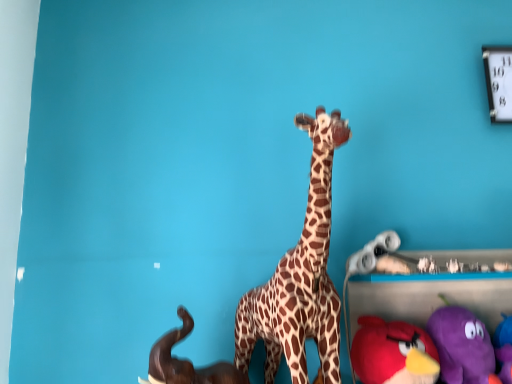
Question: Considering the relative positions of velvet plush bird at lower right, which appears as the second toy when viewed from the right, and purple plush toy at lower right, positioned as the 4th toy in left-to-right order, in the image provided, is velvet plush bird at lower right, which appears as the second toy when viewed from the right, to the left of purple plush toy at lower right, positioned as the 4th toy in left-to-right order, from the viewer's perspective?

Choices:
 (A) yes
 (B) no

Answer: (A)

Question: From the image's perspective, is velvet plush bird at lower right, which appears as the second toy when viewed from the right, beneath purple plush toy at lower right, the first toy positioned from the right?

Choices:
 (A) yes
 (B) no

Answer: (A)

Question: Considering the relative sizes of velvet plush bird at lower right, which appears as the second toy when viewed from the right, and purple plush toy at lower right, positioned as the 4th toy in left-to-right order, in the image provided, is velvet plush bird at lower right, which appears as the second toy when viewed from the right, thinner than purple plush toy at lower right, positioned as the 4th toy in left-to-right order,?

Choices:
 (A) yes
 (B) no

Answer: (A)

Question: Is velvet plush bird at lower right, positioned as the 3th toy in left-to-right order, touching purple plush toy at lower right, the first toy positioned from the right?

Choices:
 (A) yes
 (B) no

Answer: (A)

Question: Is velvet plush bird at lower right, positioned as the 3th toy in left-to-right order, shorter than purple plush toy at lower right, the first toy positioned from the right?

Choices:
 (A) yes
 (B) no

Answer: (A)

Question: In terms of height, does metallic silver clock at upper right look taller or shorter compared to brown matte elephant at lower left, marked as the 4th toy in a right-to-left arrangement?

Choices:
 (A) tall
 (B) short

Answer: (A)

Question: Is metallic silver clock at upper right bigger or smaller than brown matte elephant at lower left, marked as the 4th toy in a right-to-left arrangement?

Choices:
 (A) small
 (B) big

Answer: (A)

Question: From a real-world perspective, is metallic silver clock at upper right above or below brown matte elephant at lower left, marked as the 4th toy in a right-to-left arrangement?

Choices:
 (A) below
 (B) above

Answer: (B)

Question: Considering the positions of metallic silver clock at upper right and brown matte elephant at lower left, which appears as the 1th toy when viewed from the left, in the image, is metallic silver clock at upper right wider or thinner than brown matte elephant at lower left, which appears as the 1th toy when viewed from the left,?

Choices:
 (A) wide
 (B) thin

Answer: (B)

Question: Considering the positions of metallic silver clock at upper right and purple plush toy at lower right, positioned as the 4th toy in left-to-right order, in the image, is metallic silver clock at upper right bigger or smaller than purple plush toy at lower right, positioned as the 4th toy in left-to-right order,?

Choices:
 (A) small
 (B) big

Answer: (A)

Question: Would you say metallic silver clock at upper right is to the left or to the right of purple plush toy at lower right, the first toy positioned from the right, in the picture?

Choices:
 (A) left
 (B) right

Answer: (B)

Question: Choose the correct answer: Is metallic silver clock at upper right inside purple plush toy at lower right, positioned as the 4th toy in left-to-right order, or outside it?

Choices:
 (A) inside
 (B) outside

Answer: (B)

Question: Relative to purple plush toy at lower right, the first toy positioned from the right, is metallic silver clock at upper right in front or behind?

Choices:
 (A) behind
 (B) front

Answer: (A)

Question: Considering the positions of point (183, 331) and point (301, 279), is point (183, 331) closer or farther from the camera than point (301, 279)?

Choices:
 (A) closer
 (B) farther

Answer: (A)

Question: Looking at their shapes, would you say brown matte elephant at lower left, marked as the 4th toy in a right-to-left arrangement, is wider or thinner than brown spotted fabric giraffe at center?

Choices:
 (A) wide
 (B) thin

Answer: (B)